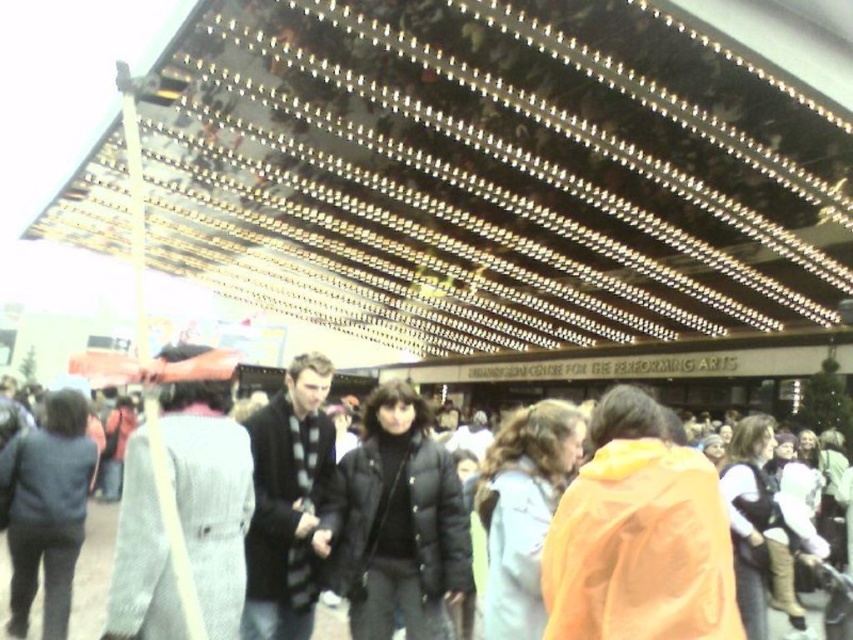
Question: Observing the image, what is the correct spatial positioning of gray wool coat at center in reference to matte black jacket at center?

Choices:
 (A) left
 (B) right

Answer: (A)

Question: Can you confirm if black puffer jacket at center is smaller than matte black jacket at center?

Choices:
 (A) no
 (B) yes

Answer: (A)

Question: Which of the following is the closest to the observer?

Choices:
 (A) black puffer jacket at center
 (B) orange matte jacket at lower right
 (C) black knit sweater at center
 (D) gray wool coat at center

Answer: (B)

Question: In this image, where is black puffer jacket at center located relative to matte black jacket at center?

Choices:
 (A) below
 (B) above

Answer: (B)

Question: Which of the following is the farthest from the observer?

Choices:
 (A) orange matte jacket at lower right
 (B) black puffer jacket at center
 (C) black knit sweater at center

Answer: (B)

Question: Which point is farther to the camera?

Choices:
 (A) matte black jacket at center
 (B) black knit sweater at center
 (C) black puffer jacket at center

Answer: (A)